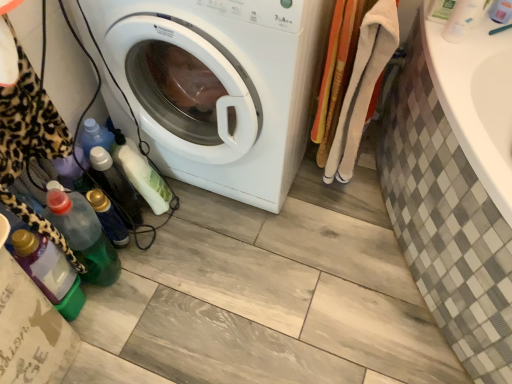
The width and height of the screenshot is (512, 384). In order to click on unoccupied area in front of soft cotton towels at right in this screenshot , I will do `click(344, 226)`.